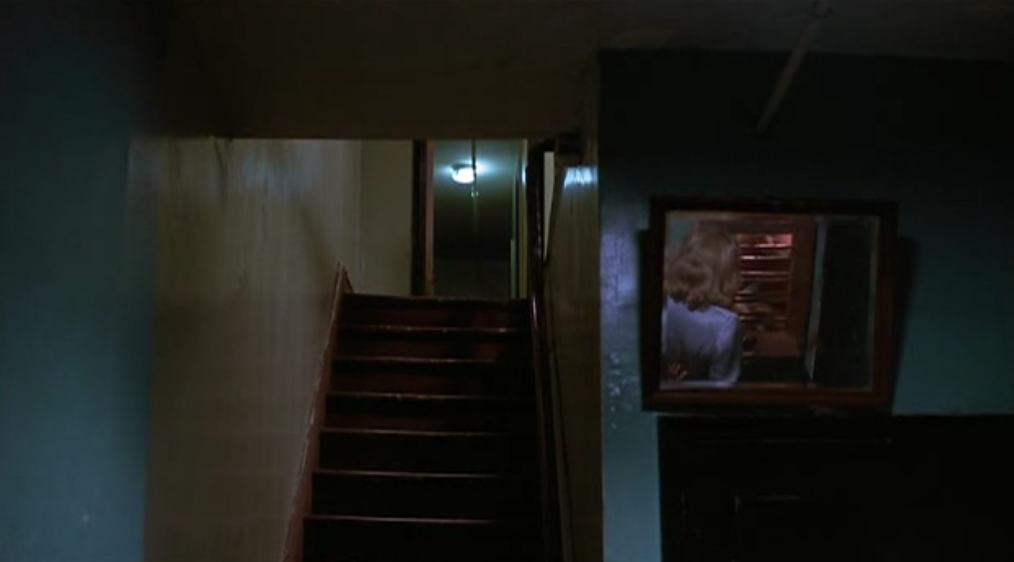
This screenshot has width=1014, height=562. I want to click on wall, so click(933, 152), click(371, 194), click(495, 53).